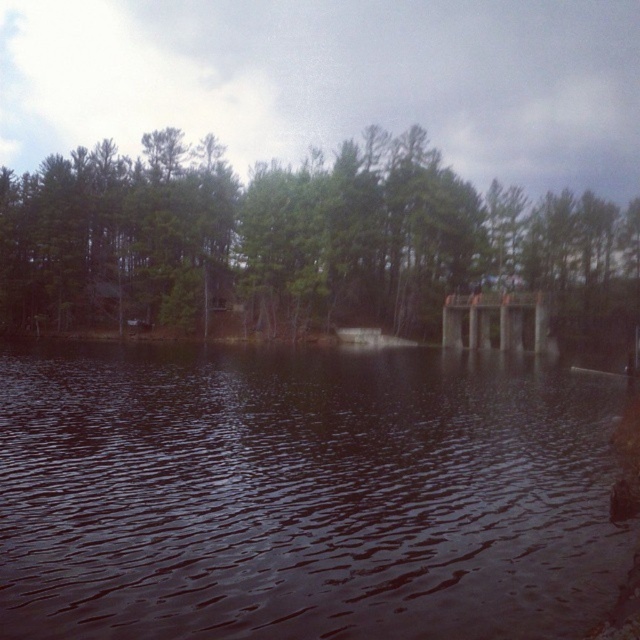
Between point (35, 602) and point (257, 289), which one is positioned behind?

The point (257, 289) is behind.

Does dark reflective water at center have a greater height compared to green leafy trees at center?

No.

Consider the image. Measure the distance between dark reflective water at center and camera.

dark reflective water at center and camera are 28.10 feet apart.

This screenshot has width=640, height=640. Find the location of `dark reflective water at center`. dark reflective water at center is located at coordinates (301, 493).

Between green leafy trees at center and wooden dock at center, which one has more height?

Standing taller between the two is green leafy trees at center.

Can you confirm if green leafy trees at center is positioned above wooden dock at center?

Indeed, green leafy trees at center is positioned over wooden dock at center.

Identify the location of green leafy trees at center. (284, 236).

Which is more to the right, dark reflective water at center or wooden dock at center?

wooden dock at center is more to the right.

Looking at this image, does dark reflective water at center have a greater height compared to wooden dock at center?

Incorrect, dark reflective water at center's height is not larger of wooden dock at center's.

Between point (577, 436) and point (547, 308), which one is positioned behind?

Point (547, 308)

Locate an element on the screen. The image size is (640, 640). dark reflective water at center is located at coordinates (301, 493).